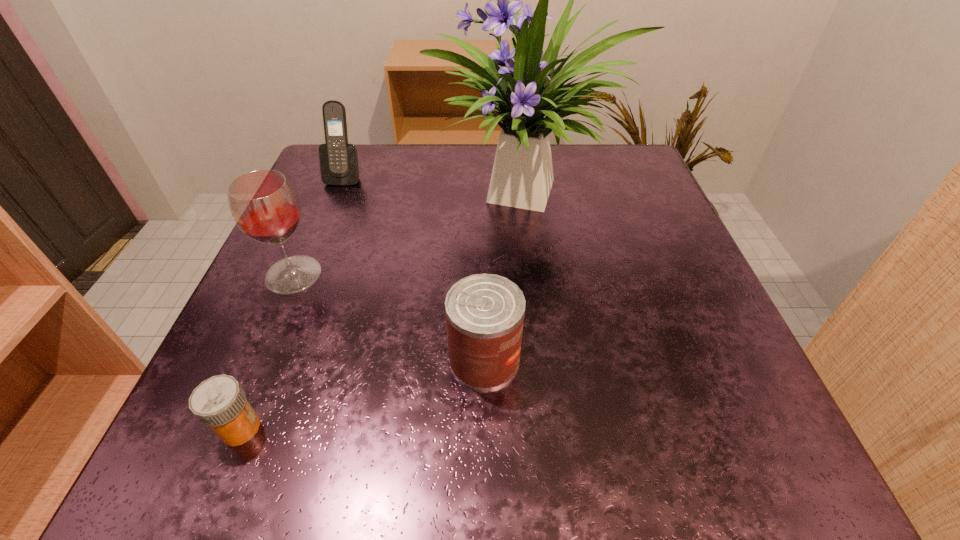
Where is `object located at the near left corner`? object located at the near left corner is located at coordinates (219, 402).

You are a GUI agent. You are given a task and a screenshot of the screen. Output one action in this format:
    pyautogui.click(x=<x>, y=<y>)
    Task: Click on the object that is at the far right corner
    
    Given the screenshot: What is the action you would take?
    pyautogui.click(x=525, y=88)

This screenshot has width=960, height=540. In the image, there is a desktop. Find the location of `vacant space at the far edge`. vacant space at the far edge is located at coordinates click(564, 182).

Identify the location of free region at the near edge of the desktop. (616, 447).

Locate an element on the screen. The width and height of the screenshot is (960, 540). vacant region at the left edge of the desktop is located at coordinates (272, 295).

In the image, there is a desktop. At what (x,y) coordinates should I click in order to perform the action: click on vacant space at the right edge. Please return your answer as a coordinate pair (x, y). The width and height of the screenshot is (960, 540). Looking at the image, I should click on (657, 334).

The image size is (960, 540). I want to click on vacant space at the far left corner of the desktop, so click(x=343, y=192).

This screenshot has width=960, height=540. In order to click on free space between the wineglass and the fourth farthest object in this screenshot , I will do `click(389, 317)`.

The height and width of the screenshot is (540, 960). Identify the location of free space that is in between the can and the third nearest object. (389, 317).

Locate an element on the screen. The image size is (960, 540). vacant area between the tallest object and the cellular telephone is located at coordinates point(437,183).